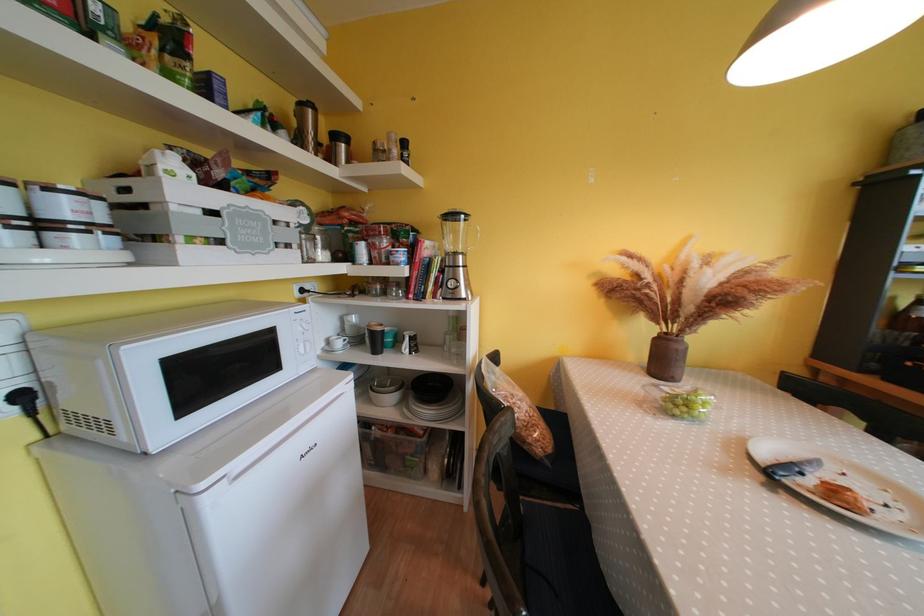
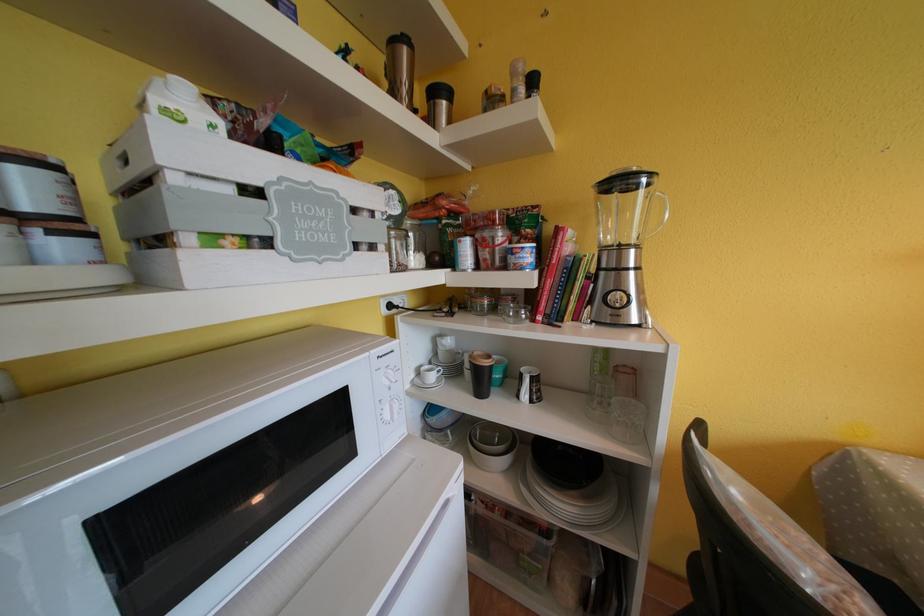
Where in the second image is the point corresponding to pixel 345 347 from the first image?

(439, 381)